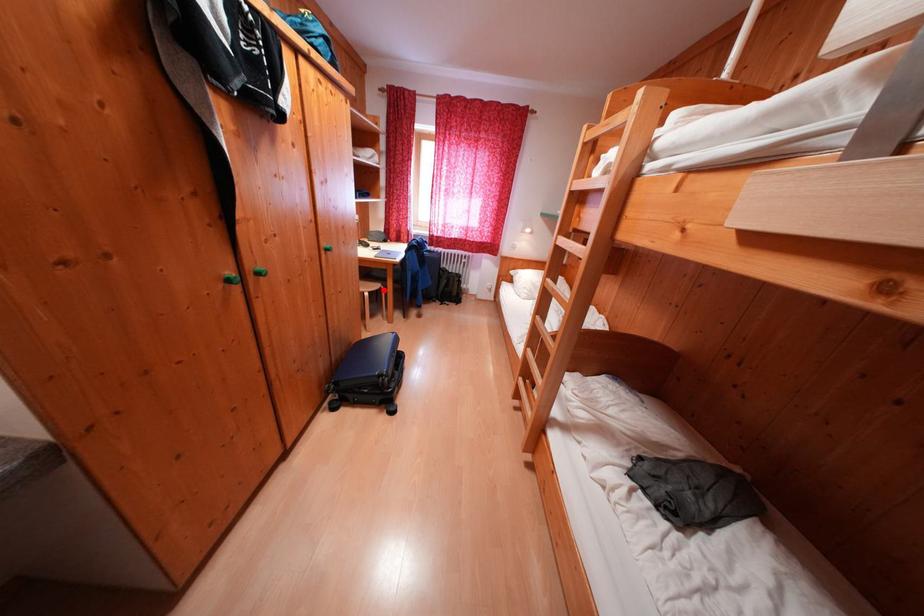
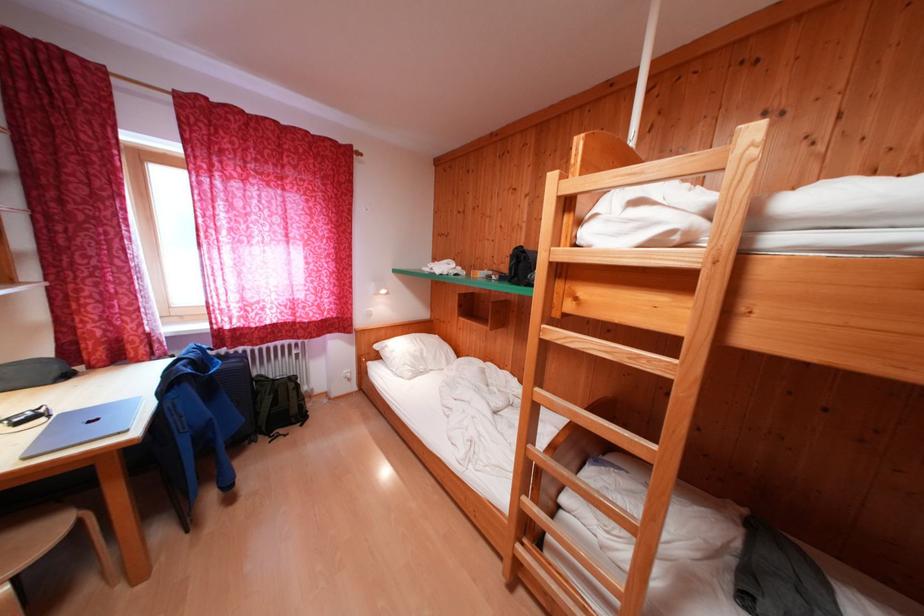
Where in the second image is the point corresponding to the highlighted location from the first image?

(55, 538)